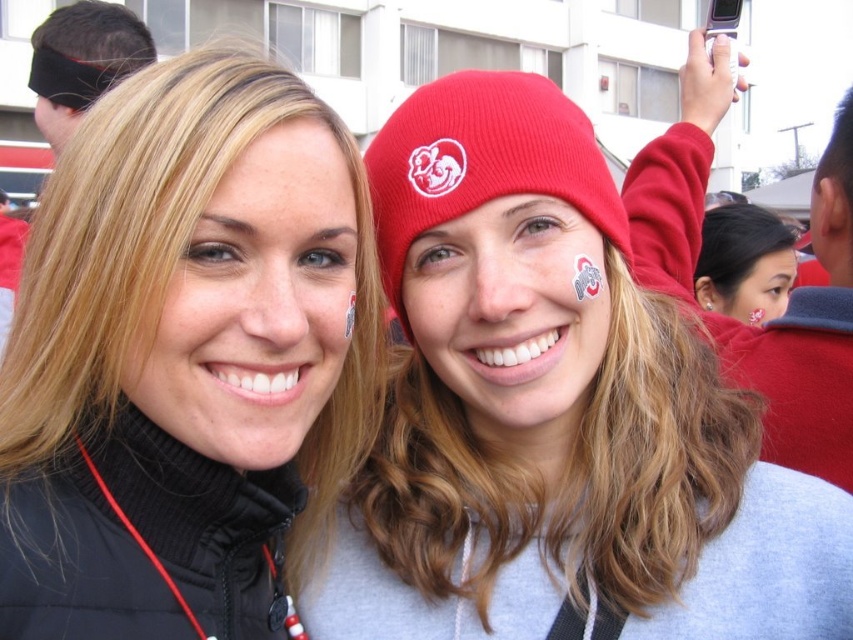
You are a photographer trying to capture a candid shot of the two people in the image. You want to ensure that the black matte jacket at left is visible in the frame. Where should you position your camera relative to the point at coordinates (186, 358)?

The black matte jacket at left is located at the point (186, 358), so you should position your camera directly at that coordinate to ensure it is visible in the frame.

You are a photographer trying to capture a clear photo of the matte red beanie at upper center and the matte red face at center. Since the two objects are close together, you need to adjust your camera focus. Which object should you focus on to ensure it appears larger in the photo?

The matte red beanie at upper center is larger in size than the matte red face at center, so focusing on the matte red beanie at upper center will ensure it appears larger in the photo.

You are taking a photo of two people standing in front of you. You notice two points marked in the image. The first point is at coordinate point (791, 257) and the second is at point (91, 19). Which point is closer to your camera?

Point (91, 19) is closer to the camera because the description states that point (791, 257) is further away than point (91, 19).